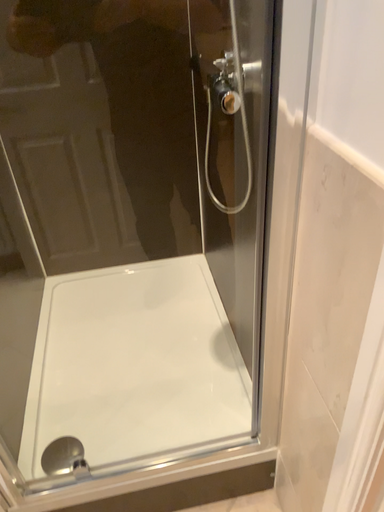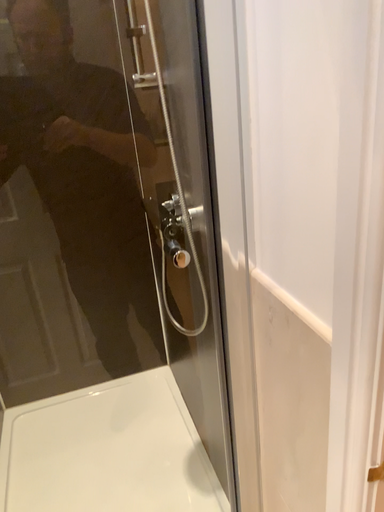
Question: How did the camera likely rotate when shooting the video?

Choices:
 (A) rotated downward
 (B) rotated upward

Answer: (B)